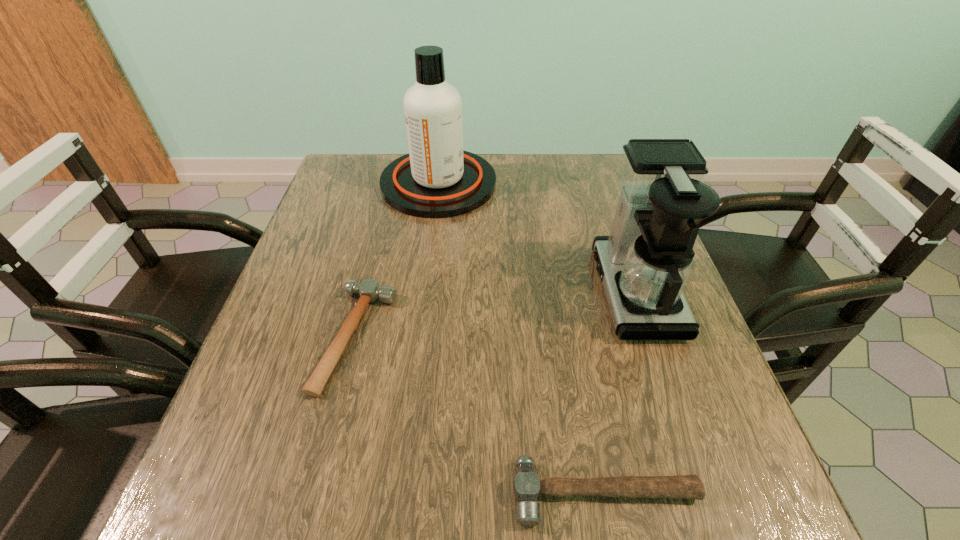
You are a GUI agent. You are given a task and a screenshot of the screen. Output one action in this format:
    pyautogui.click(x=<x>, y=<y>)
    Task: Click on the free space in the image that satisfies the following two spatial constraints: 1. on the back side of the cleansing agent; 2. on the left side of the left hammer
    The width and height of the screenshot is (960, 540).
    Given the screenshot: What is the action you would take?
    pyautogui.click(x=395, y=184)